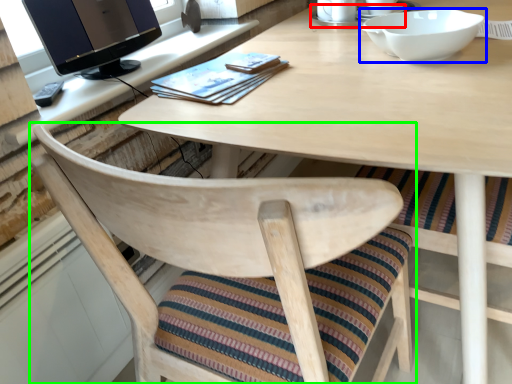
Question: Estimate the real-world distances between objects in this image. Which object is closer to saucer (highlighted by a red box), bowl (highlighted by a blue box) or chair (highlighted by a green box)?

Choices:
 (A) bowl
 (B) chair

Answer: (A)